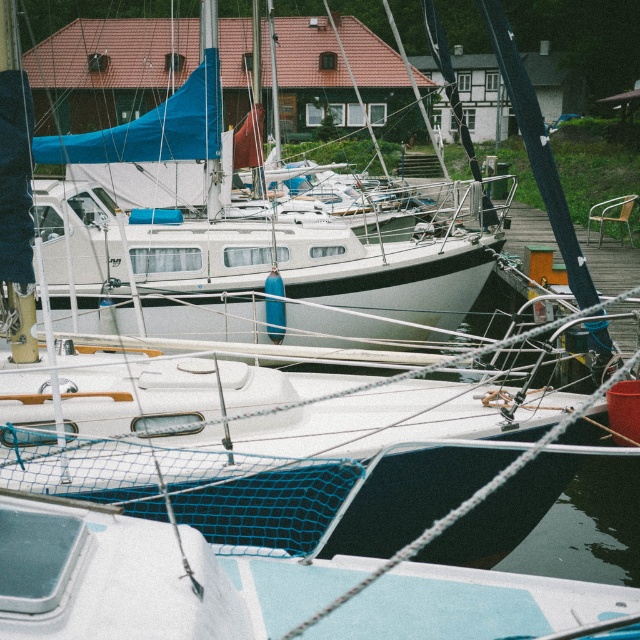
You are a dock worker who needs to ensure that two boats can fit side by side in a space that is 10 meters wide. You observe the white matte sailboat at center and the white matte boat at center. Based on their widths, can both boats fit without overlapping?

The white matte sailboat at center is wider than the white matte boat at center. Since the total width of both boats combined would exceed 10 meters, they cannot fit side by side without overlapping.

You are standing at the wooden pier and see the white matte sailboat at center and the white matte boat at center. Which one is positioned more to the left?

The white matte sailboat at center is positioned more to the left than the white matte boat at center.